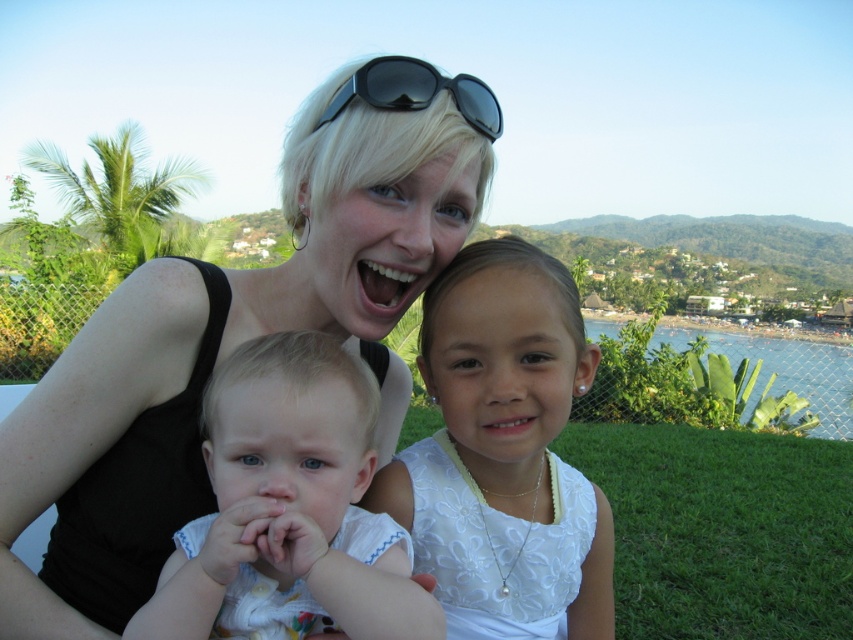
You are planning to take a photo of the white lace dress at center and the green grass at lower right. The camera you have can focus on objects within a 12 feet range. Will both objects be in focus?

The white lace dress at center is 13.20 feet away from the green grass at lower right. Since the camera can only focus within 12 feet, the distance between them exceeds the focus range. Therefore, both objects cannot be in focus simultaneously.

You are a photographer trying to capture the perfect shot of the light blue fabric baby at center and the black plastic sunglasses at upper center. To ensure both are in frame, you need to know their relative positions. Which object is located to the left of the other?

The light blue fabric baby at center is positioned on the left side of black plastic sunglasses at upper center, so the baby is to the left of the sunglasses.